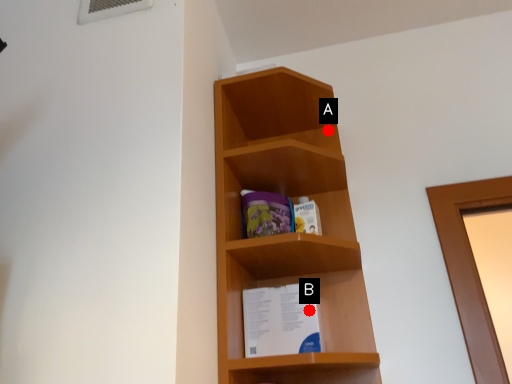
Question: Two points are circled on the image, labeled by A and B beside each circle. Which point is farther from the camera taking this photo?

Choices:
 (A) A is further
 (B) B is further

Answer: (A)